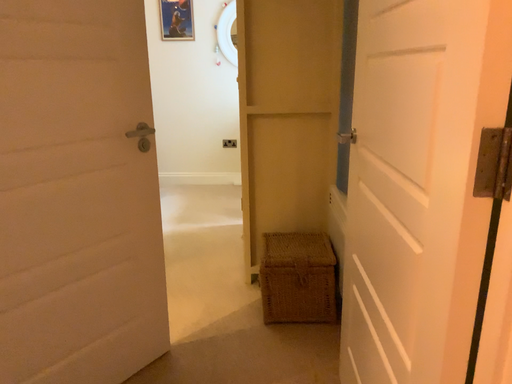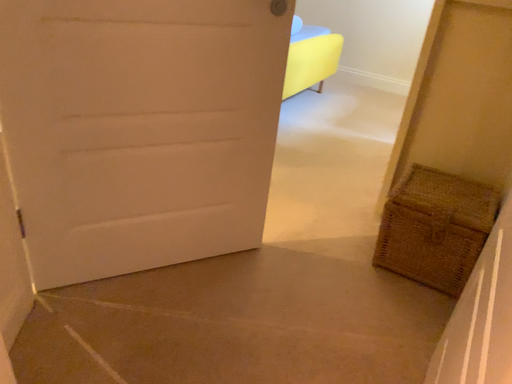
Question: How did the camera likely rotate when shooting the video?

Choices:
 (A) rotated left
 (B) rotated right

Answer: (A)